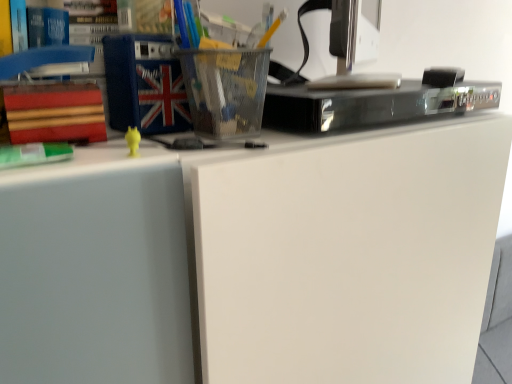
Question: From the image's perspective, does black glossy dvd player at upper center appear higher than metallic silver desktop computer at upper right?

Choices:
 (A) yes
 (B) no

Answer: (B)

Question: Would you say black glossy dvd player at upper center contains metallic silver desktop computer at upper right?

Choices:
 (A) no
 (B) yes

Answer: (A)

Question: Could you tell me if black glossy dvd player at upper center is turned towards metallic silver desktop computer at upper right?

Choices:
 (A) yes
 (B) no

Answer: (B)

Question: Is metallic silver desktop computer at upper right at the back of black glossy dvd player at upper center?

Choices:
 (A) no
 (B) yes

Answer: (A)

Question: Is black glossy dvd player at upper center behind metallic silver desktop computer at upper right?

Choices:
 (A) no
 (B) yes

Answer: (B)

Question: Is black glossy dvd player at upper center thinner than metallic silver desktop computer at upper right?

Choices:
 (A) no
 (B) yes

Answer: (A)

Question: Is green matte book at left taller than blue fabric book at upper left, placed as the 1th paperback book when sorted from right to left?

Choices:
 (A) yes
 (B) no

Answer: (B)

Question: Does green matte book at left appear on the left side of blue fabric book at upper left, which is the second paperback book in bottom-to-top order?

Choices:
 (A) yes
 (B) no

Answer: (A)

Question: From the image's perspective, is green matte book at left located beneath blue fabric book at upper left, which is the second paperback book in bottom-to-top order?

Choices:
 (A) no
 (B) yes

Answer: (B)

Question: From a real-world perspective, does green matte book at left sit lower than blue fabric book at upper left, placed as the 1th paperback book when sorted from right to left?

Choices:
 (A) yes
 (B) no

Answer: (A)

Question: From a real-world perspective, is green matte book at left physically above blue fabric book at upper left, acting as the first paperback book starting from the top?

Choices:
 (A) no
 (B) yes

Answer: (A)

Question: Is green matte book at left closer to the viewer compared to blue fabric book at upper left, the 2th paperback book when ordered from left to right?

Choices:
 (A) yes
 (B) no

Answer: (A)

Question: Is green matte book at left wider than red matte book at left, the first paperback book when ordered from left to right?

Choices:
 (A) yes
 (B) no

Answer: (B)